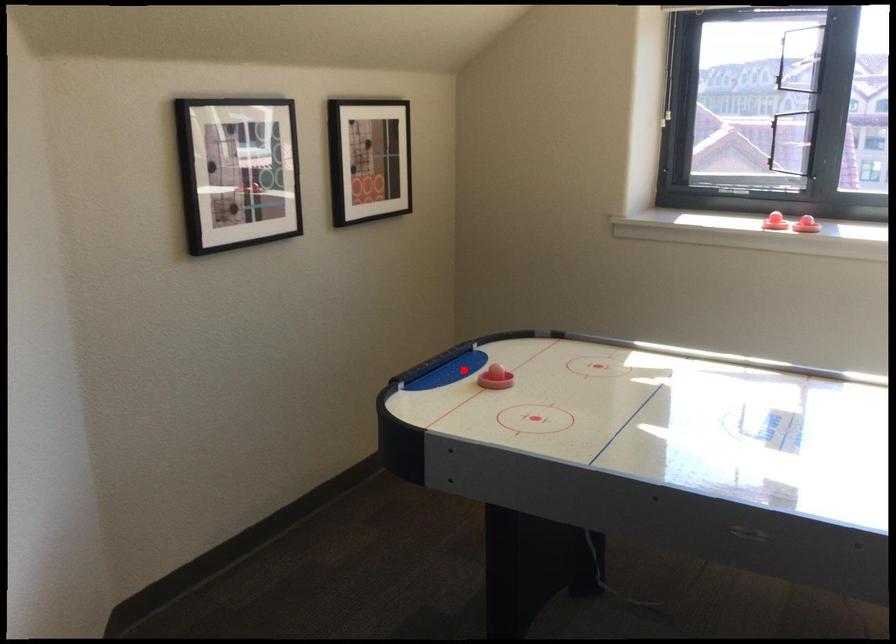
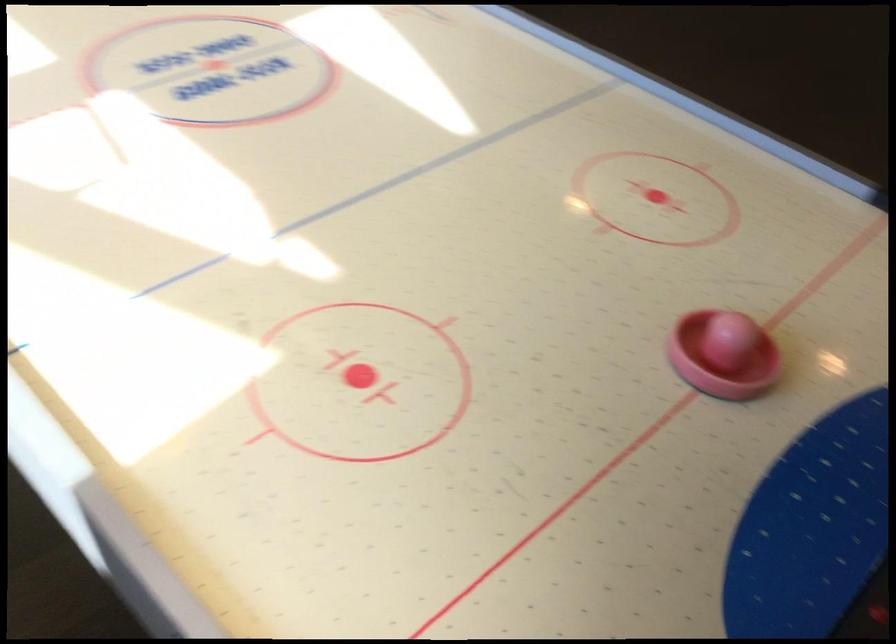
Question: A red point is marked in image1. In image2, is the corresponding 3D point closer to the camera or farther? Reply with the corresponding letter.

Choices:
 (A) The corresponding 3D point is closer.
 (B) The corresponding 3D point is farther.

Answer: (A)